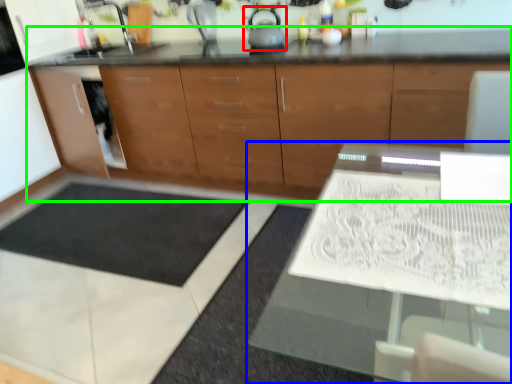
Question: Which object is positioned farthest from tea pot (highlighted by a red box)? Select from table (highlighted by a blue box) and cabinetry (highlighted by a green box).

Choices:
 (A) table
 (B) cabinetry

Answer: (A)